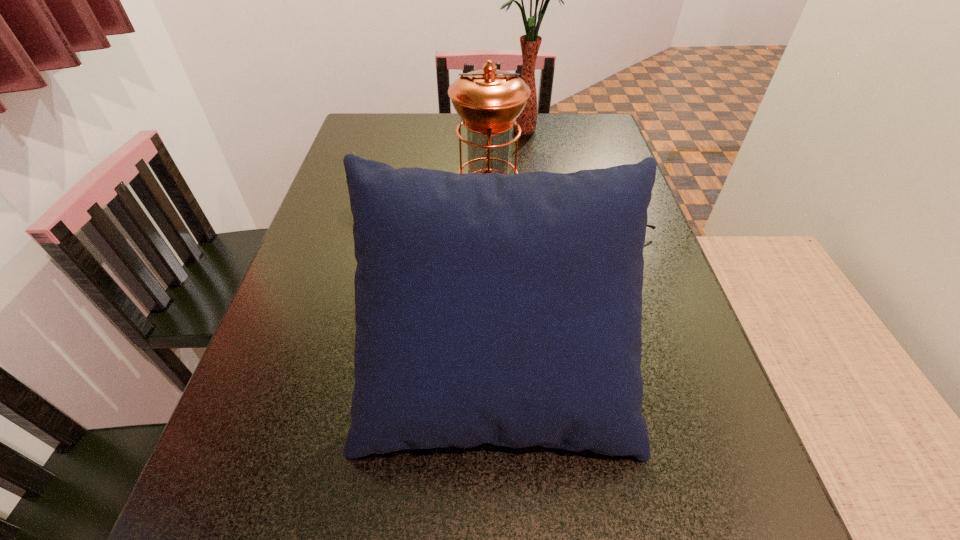
In the image, there is a desktop. At what (x,y) coordinates should I click in order to perform the action: click on free region at the far left corner. Please return your answer as a coordinate pair (x, y). This screenshot has height=540, width=960. Looking at the image, I should click on (382, 134).

I want to click on free spot at the far right corner of the desktop, so click(x=593, y=126).

Locate an element on the screen. The image size is (960, 540). free space between the farthest object and the leftmost object is located at coordinates (444, 167).

Choose which object is the third nearest neighbor to the nearest object. Please provide its 2D coordinates. Your answer should be formatted as a tuple, i.e. [(x, y)], where the tuple contains the x and y coordinates of a point satisfying the conditions above.

[(352, 151)]

Point out which object is positioned as the fourth nearest to the farthest object. Please provide its 2D coordinates. Your answer should be formatted as a tuple, i.e. [(x, y)], where the tuple contains the x and y coordinates of a point satisfying the conditions above.

[(506, 309)]

The image size is (960, 540). I want to click on vacant area in the image that satisfies the following two spatial constraints: 1. on the back side of the icecream; 2. on the right side of the farthest object, so click(387, 131).